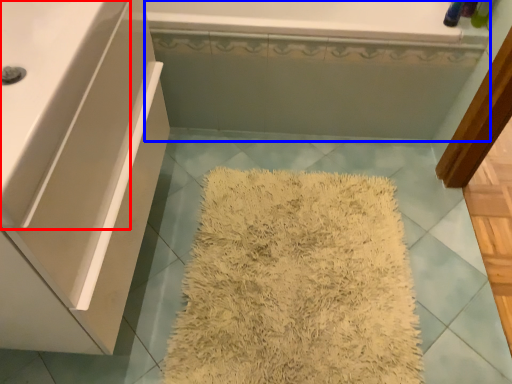
Question: Which point is further to the camera, counter top (highlighted by a red box) or bath (highlighted by a blue box)?

Choices:
 (A) counter top
 (B) bath

Answer: (B)